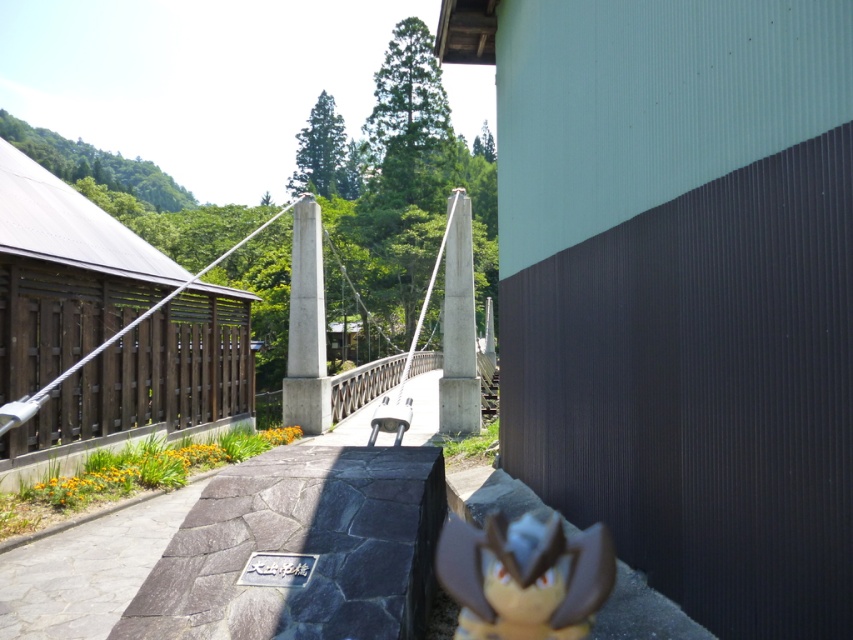
Is brown matte toy at lower center positioned before silver metallic rail at center?

That is True.

Does point (606, 554) come in front of point (404, 358)?

Yes, point (606, 554) is in front of point (404, 358).

The image size is (853, 640). I want to click on brown matte toy at lower center, so click(x=524, y=577).

Between brown matte toy at lower center and metallic silver bench at center, which one has more height?

With more height is metallic silver bench at center.

Does point (476, 556) come behind point (378, 413)?

That is False.

Is point (582, 566) behind point (404, 424)?

No.

Find the location of `brown matte toy at lower center`. brown matte toy at lower center is located at coordinates pos(524,577).

Measure the distance between silver metallic rail at center and metallic silver bench at center.

A distance of 10.94 meters exists between silver metallic rail at center and metallic silver bench at center.

In the scene shown: Does silver metallic rail at center lie behind metallic silver bench at center?

Yes, silver metallic rail at center is further from the viewer.

Does point (383, 371) come farther from viewer compared to point (386, 426)?

Yes, it is.

Locate an element on the screen. silver metallic rail at center is located at coordinates (363, 384).